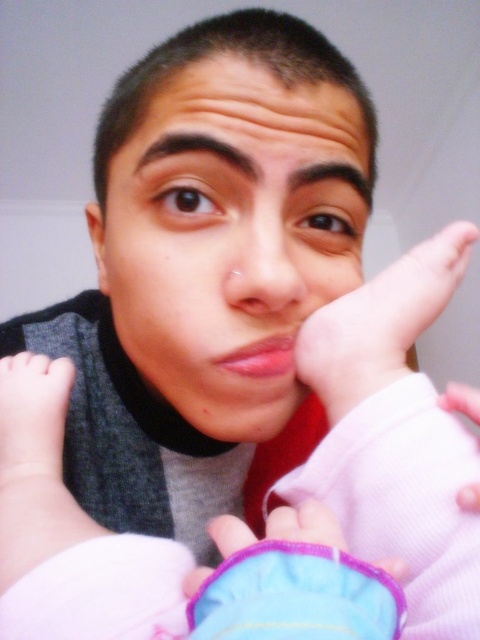
Who is positioned more to the right, pink fabric baby foot at center or matte skin nose at center?

pink fabric baby foot at center is more to the right.

Can you confirm if pink fabric baby foot at center is bigger than matte skin nose at center?

Indeed, pink fabric baby foot at center has a larger size compared to matte skin nose at center.

Is point (402, 262) farther from camera compared to point (233, 284)?

Yes, point (402, 262) is farther from viewer.

The width and height of the screenshot is (480, 640). Identify the location of pink fabric baby foot at center. (380, 321).

Can you confirm if pink fabric baby hand at lower left is positioned to the right of pink fabric hand at right?

Incorrect, pink fabric baby hand at lower left is not on the right side of pink fabric hand at right.

Does pink fabric baby hand at lower left have a greater width compared to pink fabric hand at right?

Indeed, pink fabric baby hand at lower left has a greater width compared to pink fabric hand at right.

Locate an element on the screen. This screenshot has width=480, height=640. pink fabric baby hand at lower left is located at coordinates (33, 419).

Does point (22, 561) come behind point (285, 518)?

No.

Can you confirm if white soft baby arm at lower left is wider than purple fabric glove at lower center?

Yes, white soft baby arm at lower left is wider than purple fabric glove at lower center.

What are the coordinates of `white soft baby arm at lower left` in the screenshot? It's located at (70, 532).